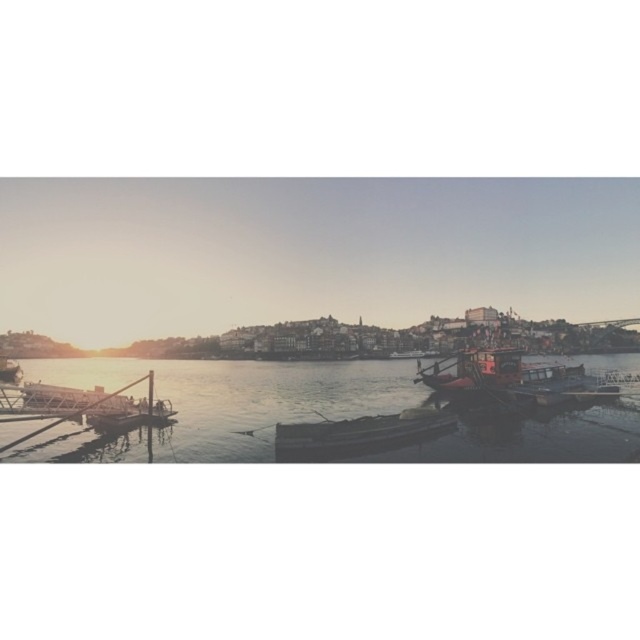
Is clear water at lower left closer to the viewer compared to metallic dock at lower left?

No, clear water at lower left is behind metallic dock at lower left.

In the scene shown: Does clear water at lower left have a greater height compared to metallic dock at lower left?

Yes, clear water at lower left is taller than metallic dock at lower left.

Is point (141, 436) farther from viewer compared to point (12, 413)?

Yes.

This screenshot has height=640, width=640. In order to click on clear water at lower left in this screenshot , I will do `click(243, 397)`.

Based on the photo, can you confirm if metallic dock at lower left is thinner than wooden boat at center?

Incorrect, metallic dock at lower left's width is not less than wooden boat at center's.

Does metallic dock at lower left have a smaller size compared to wooden boat at center?

No, metallic dock at lower left is not smaller than wooden boat at center.

Measure the distance between point [40,401] and camera.

Point [40,401] and camera are 64.52 meters apart from each other.

Find the location of `metallic dock at lower left`. metallic dock at lower left is located at coordinates (83, 408).

Between clear water at lower left and wooden boat at right, which one appears on the right side from the viewer's perspective?

wooden boat at right

Between clear water at lower left and wooden boat at right, which one has less height?

wooden boat at right is shorter.

The width and height of the screenshot is (640, 640). I want to click on clear water at lower left, so click(x=243, y=397).